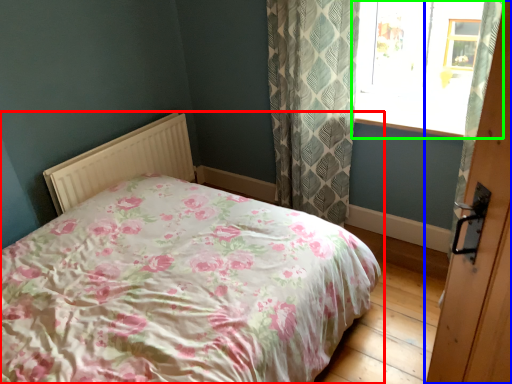
Question: Which object is the farthest from bed (highlighted by a red box)? Choose among these: door (highlighted by a blue box) or window (highlighted by a green box).

Choices:
 (A) door
 (B) window

Answer: (B)